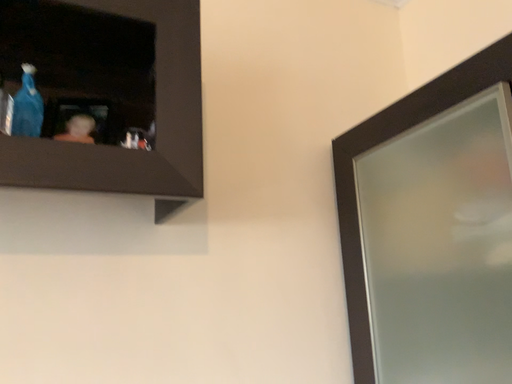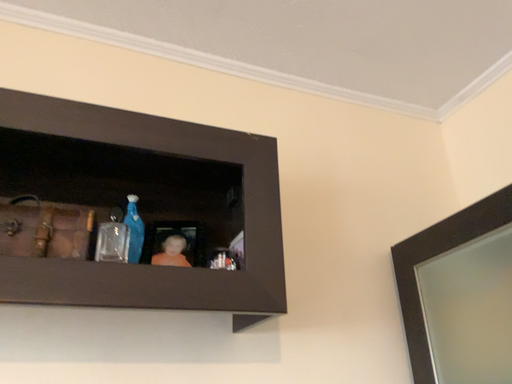
Question: Which way did the camera rotate in the video?

Choices:
 (A) rotated upward
 (B) rotated downward

Answer: (A)